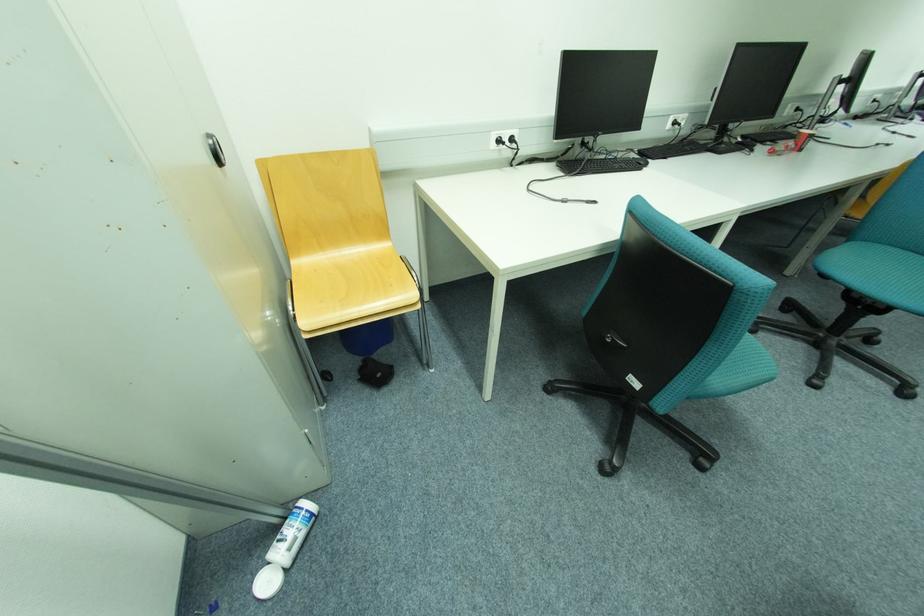
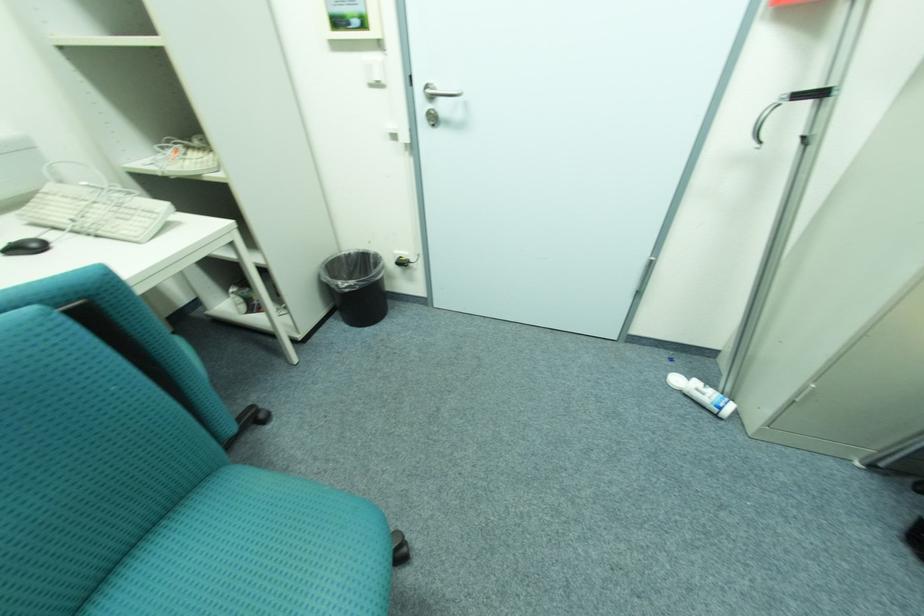
Find the pixel in the second image that matches pixel 274 584 in the first image.

(683, 381)